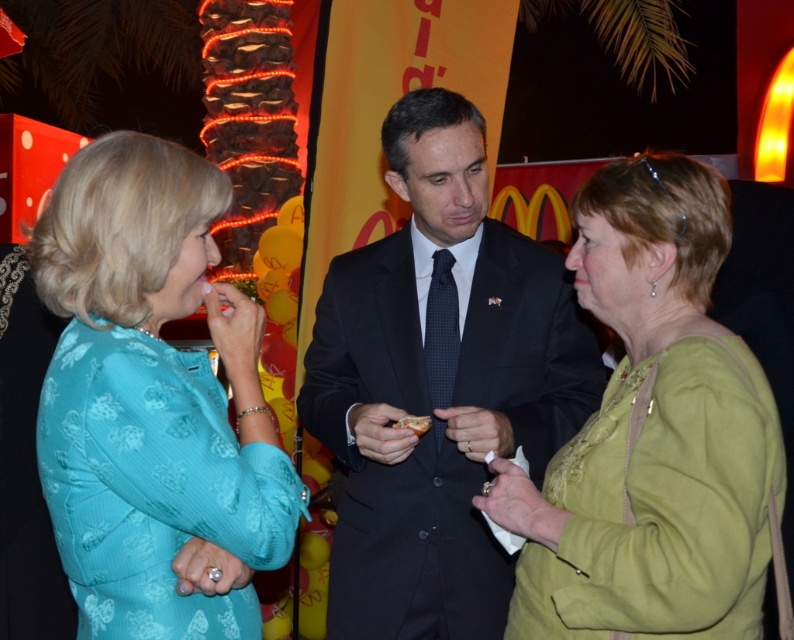
Does point (476, 198) lie behind point (178, 394)?

Yes, it is behind point (178, 394).

Which is in front, point (376, 604) or point (241, 499)?

Positioned in front is point (241, 499).

Which is in front, point (463, 531) or point (151, 164)?

Point (151, 164)

Identify the location of dark suit at center. (437, 385).

Can you confirm if dark suit at center is positioned to the left of green fabric jacket at center?

Indeed, dark suit at center is positioned on the left side of green fabric jacket at center.

Is dark suit at center to the right of green fabric jacket at center from the viewer's perspective?

In fact, dark suit at center is to the left of green fabric jacket at center.

Between point (422, 362) and point (702, 193), which one is positioned in front?

Point (702, 193) is more forward.

The width and height of the screenshot is (794, 640). I want to click on dark suit at center, so click(x=437, y=385).

Who is more forward, [160,436] or [679,593]?

Point [679,593] is more forward.

Which is behind, point (51, 246) or point (677, 291)?

Point (677, 291)

Locate an element on the screen. This screenshot has width=794, height=640. teal fabric dress at left is located at coordinates (153, 403).